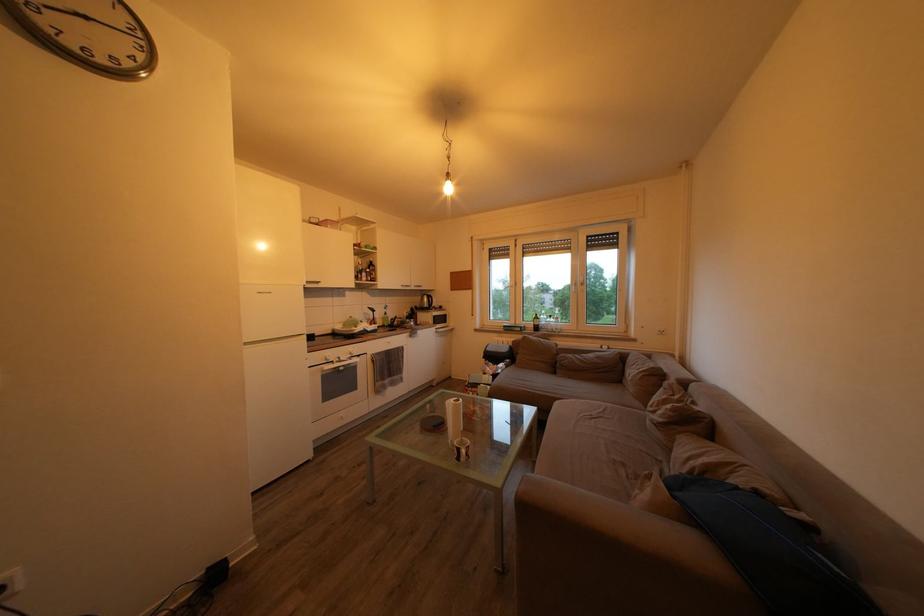
Where is `sofa armrest`? The width and height of the screenshot is (924, 616). sofa armrest is located at coordinates (590, 539).